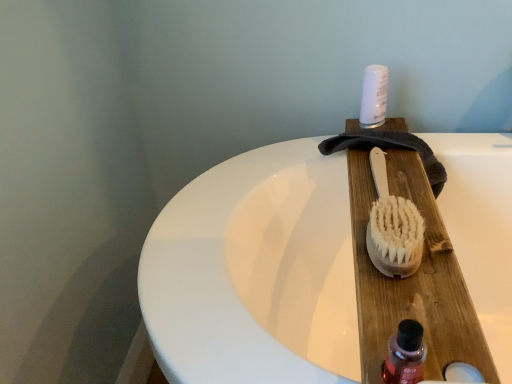
At what (x,y) coordinates should I click in order to perform the action: click on free region under natural wood brush at center (from a real-world perspective). Please return your answer as a coordinate pair (x, y). Looking at the image, I should click on (381, 175).